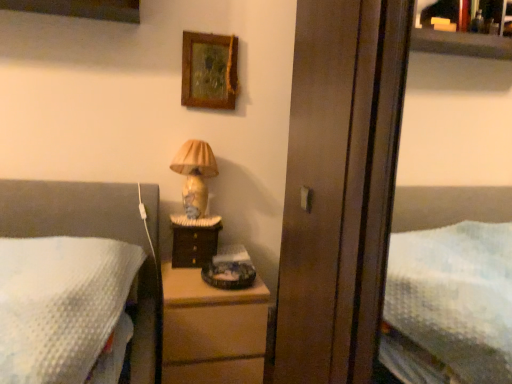
Question: Is wooden picture frame at upper center situated inside matte ceramic lamp at upper center or outside?

Choices:
 (A) inside
 (B) outside

Answer: (B)

Question: From a real-world perspective, is wooden picture frame at upper center above or below matte ceramic lamp at upper center?

Choices:
 (A) above
 (B) below

Answer: (A)

Question: Which object is the farthest from the wooden chest of drawers at center?

Choices:
 (A) dark wood nightstand at center
 (B) wooden screen door at center
 (C) wooden picture frame at upper center
 (D) matte ceramic lamp at upper center

Answer: (C)

Question: Which object is positioned farthest from the matte ceramic lamp at upper center?

Choices:
 (A) wooden chest of drawers at center
 (B) wooden picture frame at upper center
 (C) wooden screen door at center
 (D) dark wood nightstand at center

Answer: (C)